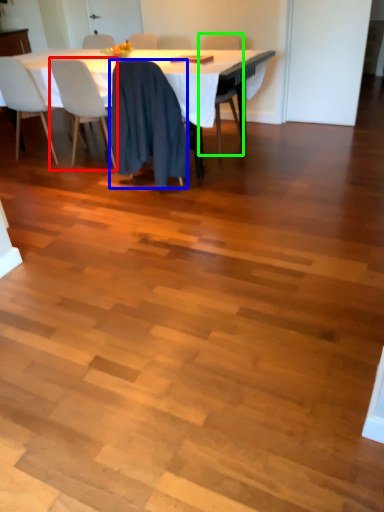
Question: Considering the real-world distances, which object is closest to chair (highlighted by a red box)? chair (highlighted by a blue box) or chair (highlighted by a green box).

Choices:
 (A) chair
 (B) chair

Answer: (A)